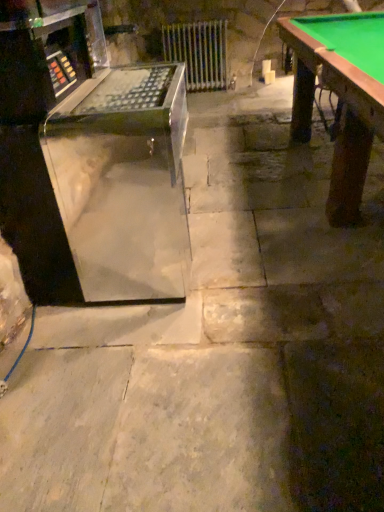
Question: From their relative heights in the image, would you say transparent acrylic machine at left is taller or shorter than metallic silver radiator at center?

Choices:
 (A) tall
 (B) short

Answer: (A)

Question: Looking at their shapes, would you say transparent acrylic machine at left is wider or thinner than metallic silver radiator at center?

Choices:
 (A) wide
 (B) thin

Answer: (A)

Question: Considering their positions, is transparent acrylic machine at left located in front of or behind metallic silver radiator at center?

Choices:
 (A) behind
 (B) front

Answer: (B)

Question: Considering the positions of metallic silver radiator at center and transparent acrylic machine at left in the image, is metallic silver radiator at center wider or thinner than transparent acrylic machine at left?

Choices:
 (A) thin
 (B) wide

Answer: (A)

Question: From the image's perspective, relative to transparent acrylic machine at left, is metallic silver radiator at center above or below?

Choices:
 (A) below
 (B) above

Answer: (B)

Question: Is point (223, 58) positioned closer to the camera than point (99, 204)?

Choices:
 (A) farther
 (B) closer

Answer: (A)

Question: Considering the positions of metallic silver radiator at center and transparent acrylic machine at left in the image, is metallic silver radiator at center taller or shorter than transparent acrylic machine at left?

Choices:
 (A) short
 (B) tall

Answer: (A)